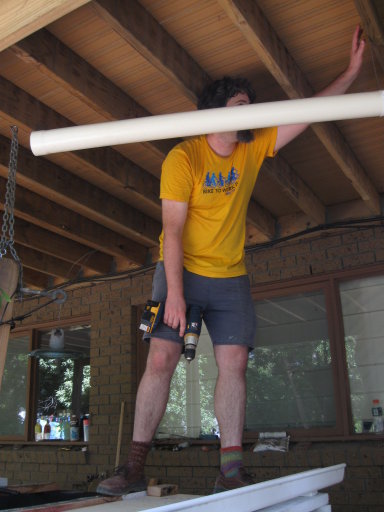
At what (x,y) coordinates should I click in order to perform the action: click on wall. Please return your answer as a coordinate pair (x, y). Image resolution: width=384 pixels, height=512 pixels. Looking at the image, I should click on (114, 376), (337, 248), (364, 475), (87, 303), (22, 461).